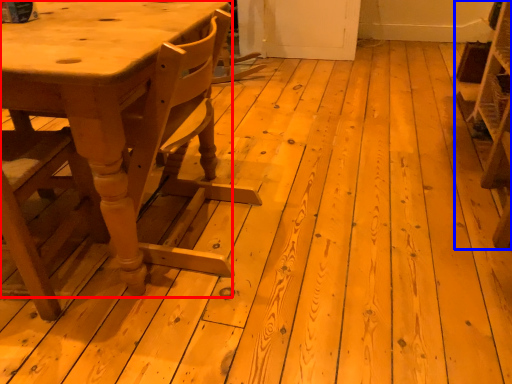
Question: Which of the following is the closest to the observer, table (highlighted by a red box) or shelf (highlighted by a blue box)?

Choices:
 (A) table
 (B) shelf

Answer: (A)